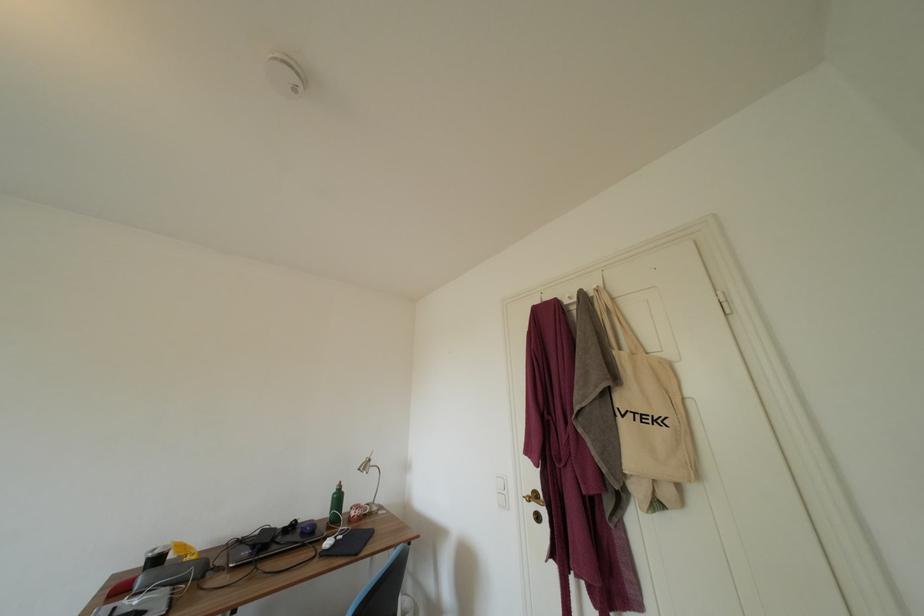
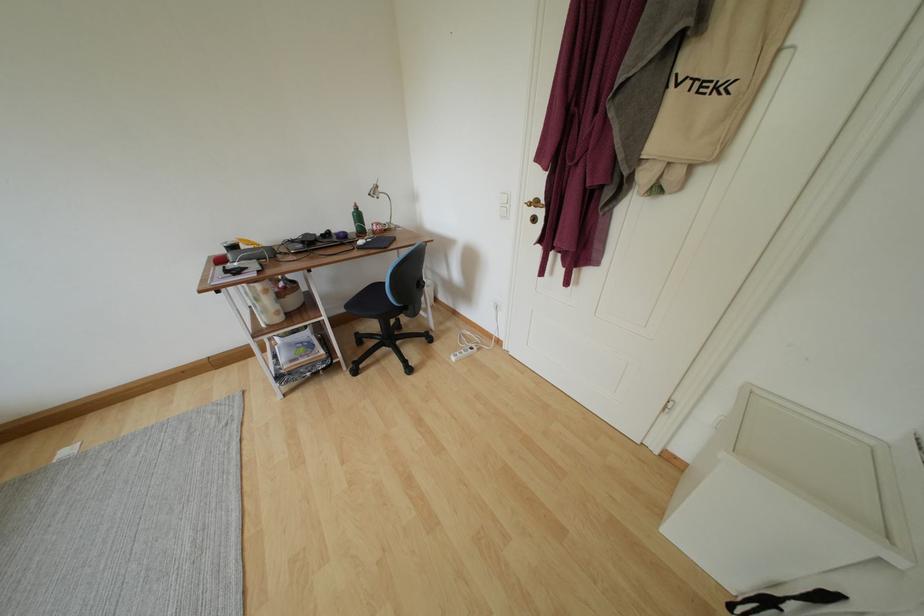
Locate, in the second image, the point that corresponds to pixel 304 535 in the first image.

(339, 241)